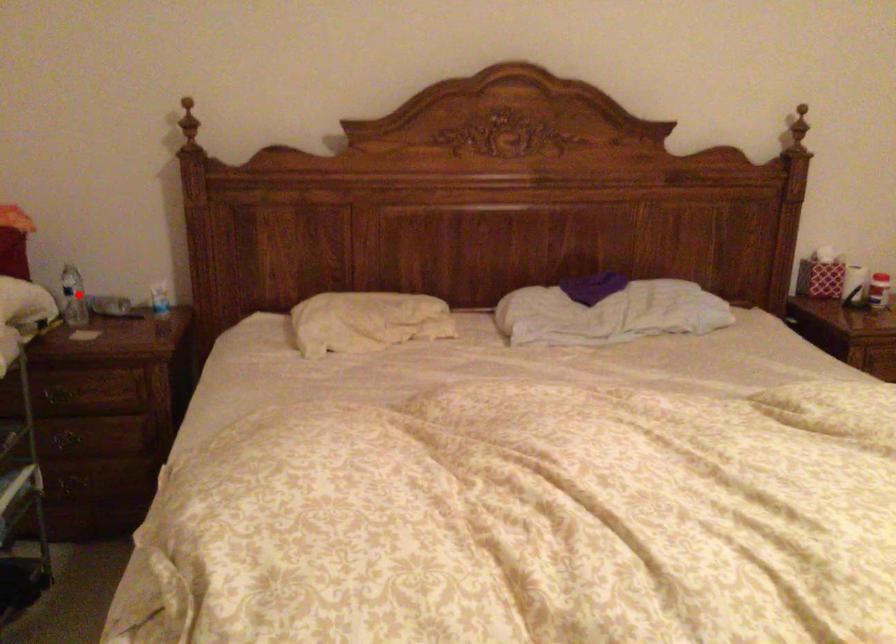
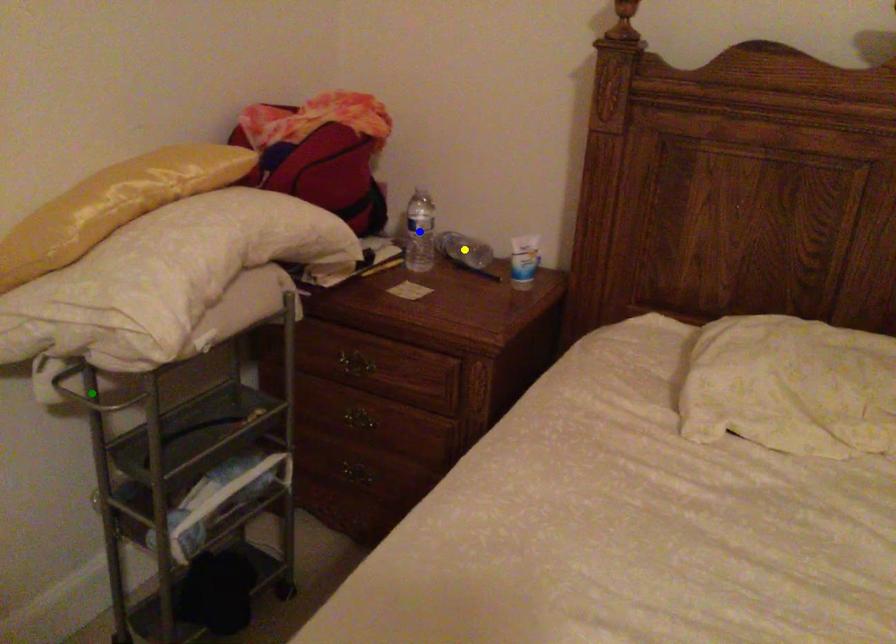
Question: I am providing you with two images of the same scene from different viewpoints. A red point is marked on the first image. You are given multiple points on the second image. Which spot in image 2 lines up with the point in image 1?

Choices:
 (A) blue point
 (B) yellow point
 (C) green point

Answer: (A)